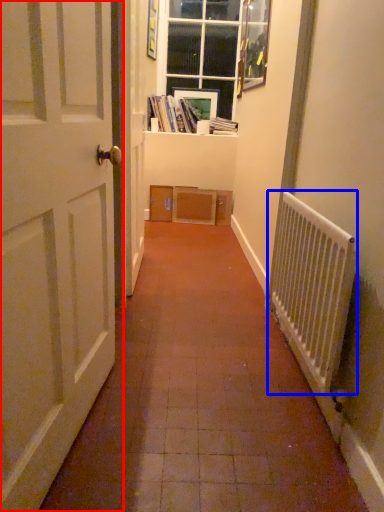
Question: Which object is further to the camera taking this photo, door (highlighted by a red box) or radiator (highlighted by a blue box)?

Choices:
 (A) door
 (B) radiator

Answer: (B)